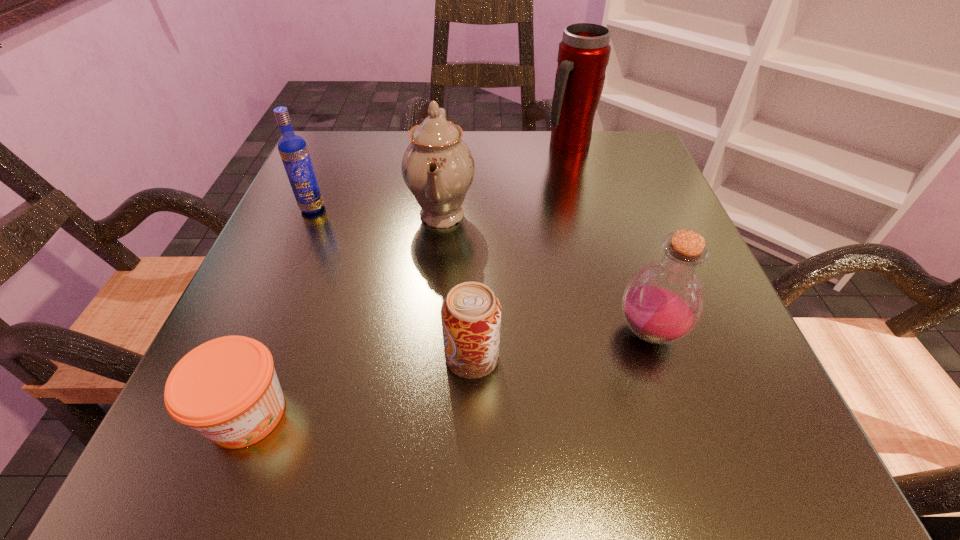
Where is `free spot between the shortest object and the vodka`? The width and height of the screenshot is (960, 540). free spot between the shortest object and the vodka is located at coordinates (280, 310).

Image resolution: width=960 pixels, height=540 pixels. What are the coordinates of `unoccupied position between the chinaware and the jam` in the screenshot? It's located at (345, 314).

The image size is (960, 540). I want to click on free space between the beer can and the shortest object, so click(x=360, y=386).

You are a GUI agent. You are given a task and a screenshot of the screen. Output one action in this format:
    pyautogui.click(x=<x>, y=<y>)
    Task: Click on the vacant space that's between the thermos bottle and the chinaware
    
    Given the screenshot: What is the action you would take?
    pyautogui.click(x=505, y=179)

The image size is (960, 540). What are the coordinates of `free area in between the second shortest object and the bottle` in the screenshot? It's located at (561, 345).

Where is `the fifth closest object to the chinaware`? the fifth closest object to the chinaware is located at coordinates (226, 389).

Where is `object identified as the fifth closest to the vodka`? This screenshot has height=540, width=960. object identified as the fifth closest to the vodka is located at coordinates (663, 301).

Locate an element on the screen. The width and height of the screenshot is (960, 540). free space that satisfies the following two spatial constraints: 1. on the spout of the chinaware; 2. on the right side of the beer can is located at coordinates (428, 357).

Locate an element on the screen. The image size is (960, 540). vacant space that satisfies the following two spatial constraints: 1. on the spout of the fifth tallest object; 2. on the right side of the chinaware is located at coordinates click(x=428, y=357).

This screenshot has height=540, width=960. In order to click on free space that satisfies the following two spatial constraints: 1. on the side with the handle of the farthest object; 2. on the left side of the bottle in this screenshot , I will do `click(619, 332)`.